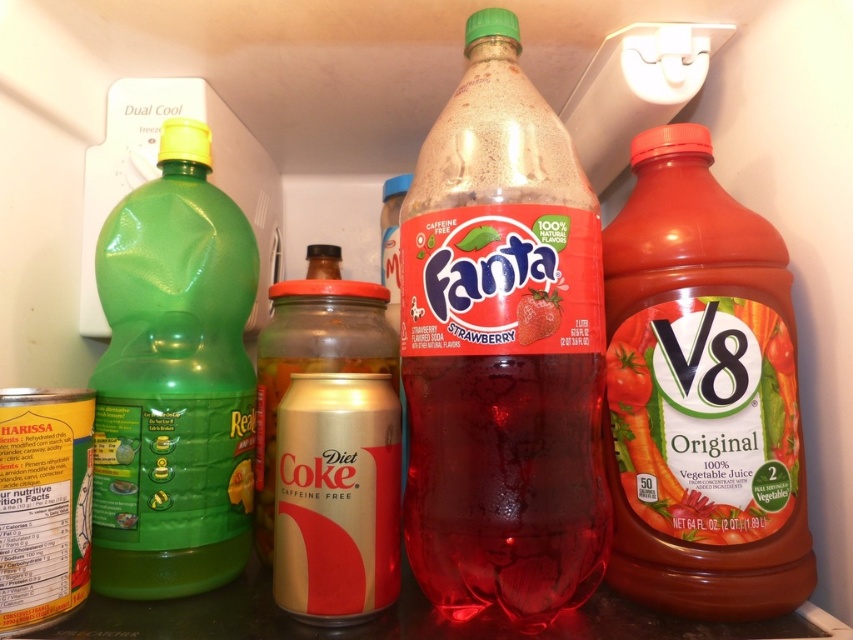
Does green plastic bottle at left lie in front of strawberry-flavored soda at center?

No, it is behind strawberry-flavored soda at center.

Is green plastic bottle at left to the left of strawberry-flavored soda at center from the viewer's perspective?

Yes, green plastic bottle at left is to the left of strawberry-flavored soda at center.

The image size is (853, 640). What do you see at coordinates (173, 381) in the screenshot?
I see `green plastic bottle at left` at bounding box center [173, 381].

This screenshot has width=853, height=640. I want to click on green plastic bottle at left, so click(x=173, y=381).

Does translucent plastic bottle at center have a smaller size compared to red matte plastic v8 juice at right?

No.

Is point (428, 272) closer to viewer compared to point (764, 420)?

Yes.

Is point (402, 284) less distant than point (666, 442)?

No, it is not.

You are a GUI agent. You are given a task and a screenshot of the screen. Output one action in this format:
    pyautogui.click(x=<x>, y=<y>)
    Task: Click on the translucent plastic bottle at center
    This screenshot has height=640, width=853.
    Given the screenshot: What is the action you would take?
    pyautogui.click(x=502, y=349)

Who is shorter, translucent plastic bottle at center or green plastic bottle at left?

With less height is green plastic bottle at left.

Is the position of translucent plastic bottle at center more distant than that of green plastic bottle at left?

No, translucent plastic bottle at center is closer to the viewer.

Does point (486, 390) come closer to viewer compared to point (97, 552)?

That is True.

Locate an element on the screen. The width and height of the screenshot is (853, 640). translucent plastic bottle at center is located at coordinates (502, 349).